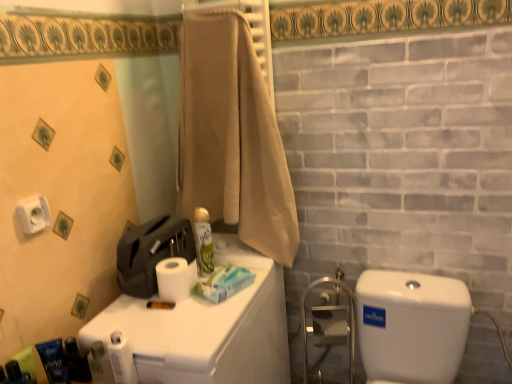
Question: Is white matte toilet paper at upper center, placed as the second toilet paper when sorted from top to bottom, oriented towards blue matte tube at lower left, which is the 2th toiletry in left-to-right order?

Choices:
 (A) yes
 (B) no

Answer: (B)

Question: From the image's perspective, would you say white matte toilet paper at upper center, which is the first toilet paper in right-to-left order, is shown under blue matte tube at lower left, the 4th toiletry from the back?

Choices:
 (A) no
 (B) yes

Answer: (A)

Question: Can you confirm if white matte toilet paper at upper center, which appears as the third toilet paper when viewed from the front, is wider than blue matte tube at lower left, positioned as the second toiletry in front-to-back order?

Choices:
 (A) yes
 (B) no

Answer: (A)

Question: Is white matte toilet paper at upper center, which appears as the third toilet paper when viewed from the front, not near blue matte tube at lower left, the 4th toiletry from the back?

Choices:
 (A) no
 (B) yes

Answer: (A)

Question: Considering the relative positions of white matte toilet paper at upper center, placed as the second toilet paper when sorted from top to bottom, and blue matte tube at lower left, which is the 2th toiletry in left-to-right order, in the image provided, is white matte toilet paper at upper center, placed as the second toilet paper when sorted from top to bottom, to the right of blue matte tube at lower left, which is the 2th toiletry in left-to-right order, from the viewer's perspective?

Choices:
 (A) yes
 (B) no

Answer: (A)

Question: Is the depth of white matte toilet paper at upper center, placed as the first toilet paper when sorted from back to front, less than that of blue matte tube at lower left, the 4th toiletry from the back?

Choices:
 (A) yes
 (B) no

Answer: (B)

Question: From the image's perspective, is metallic blue soap dispenser at lower left, the 2th toiletry from the back, located above beige cotton towel at upper center?

Choices:
 (A) yes
 (B) no

Answer: (B)

Question: From a real-world perspective, does metallic blue soap dispenser at lower left, the 2th toiletry when ordered from right to left, sit lower than beige cotton towel at upper center?

Choices:
 (A) yes
 (B) no

Answer: (A)

Question: Can beige cotton towel at upper center be found inside metallic blue soap dispenser at lower left, the 2th toiletry when ordered from right to left?

Choices:
 (A) no
 (B) yes

Answer: (A)

Question: Does metallic blue soap dispenser at lower left, the 2th toiletry from the back, turn towards beige cotton towel at upper center?

Choices:
 (A) no
 (B) yes

Answer: (A)

Question: From the image's perspective, would you say metallic blue soap dispenser at lower left, the fourth toiletry in the left-to-right sequence, is shown under beige cotton towel at upper center?

Choices:
 (A) no
 (B) yes

Answer: (B)

Question: Is metallic blue soap dispenser at lower left, the 4th toiletry in the front-to-back sequence, closer to camera compared to beige cotton towel at upper center?

Choices:
 (A) yes
 (B) no

Answer: (A)

Question: From a real-world perspective, is blue matte tube at lower left, the fourth toiletry from the right, under green matte spray can at center, the fifth toiletry when ordered from left to right?

Choices:
 (A) no
 (B) yes

Answer: (B)